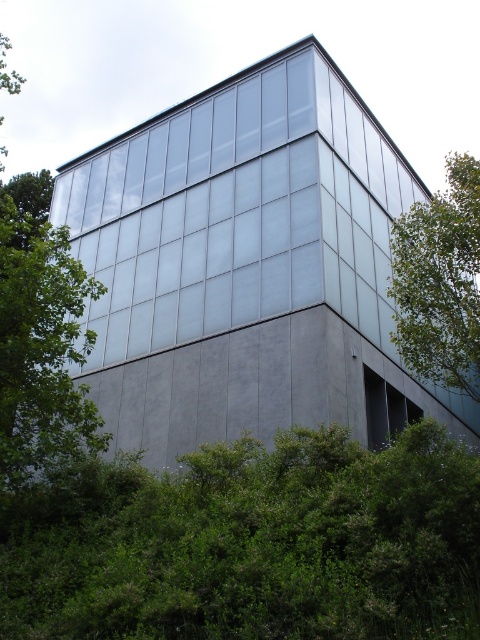
You are standing in front of the modern building and want to place a small garden ornament between the green leafy bush at lower center and the glass facade. Based on the coordinates provided, can you determine which direction you should move relative to the bush to reach the glass facade?

The green leafy bush at lower center is located at point (251, 544). Since the glass facade is part of the upper portion of the building, you should move upward from the bush to reach the glass facade.

You are standing in front of the modern building and notice a point marked at coordinates (x=251, y=544). Based on the scene description, what object does this point most likely represent?

The point at coordinates (x=251, y=544) most likely represents the green leafy bush at lower center as described in the scene.

You are standing in front of the modern building and want to take a photo of the transparent glass window at center. However, there is a green leafy bush at lower center blocking your view. Which direction should you move to avoid the obstruction?

The green leafy bush at lower center is to the left of the transparent glass window at center. To avoid the obstruction, you should move to the right side of the building to get a clear view of the transparent glass window at center.